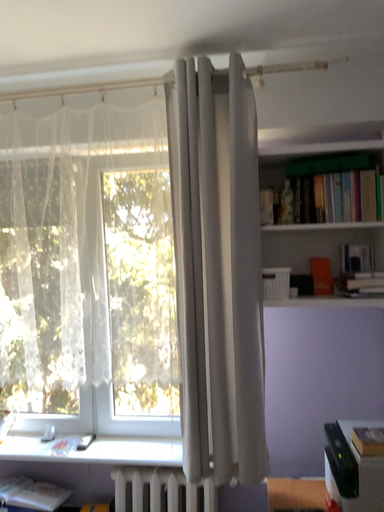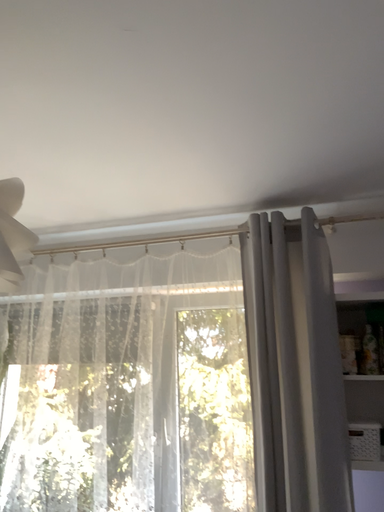
Question: How did the camera likely rotate when shooting the video?

Choices:
 (A) rotated right
 (B) rotated left

Answer: (B)